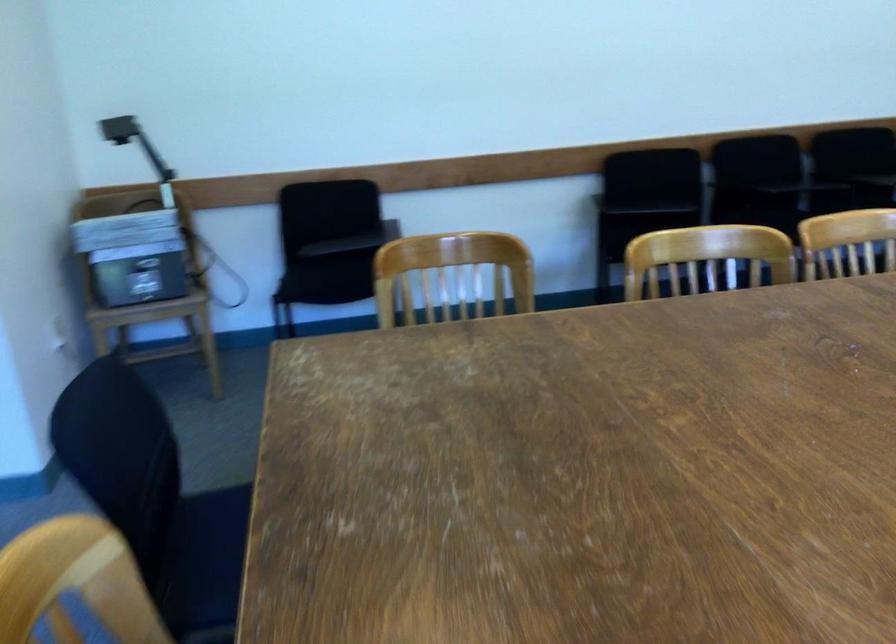
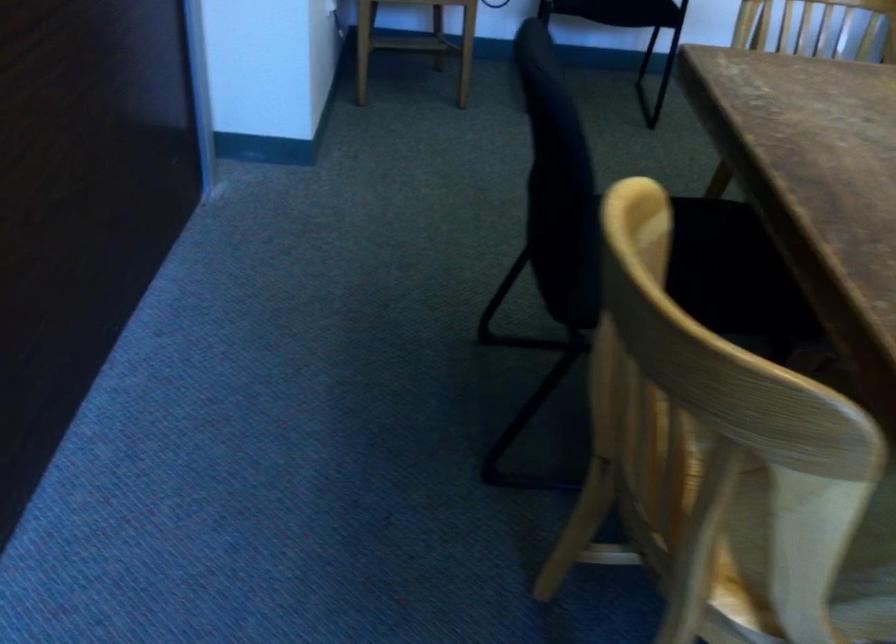
Question: In a continuous first-person perspective shot, in which direction is the camera moving?

Choices:
 (A) Left
 (B) Right
 (C) Forward
 (D) Backward

Answer: (A)